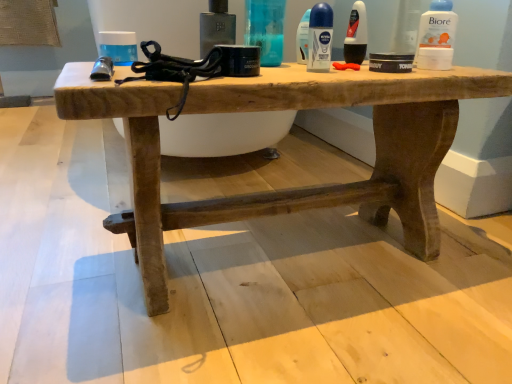
The height and width of the screenshot is (384, 512). In order to click on unoccupied area in front of translucent plastic bottle at upper center, the second toiletry viewed from the right in this screenshot , I will do pos(290,69).